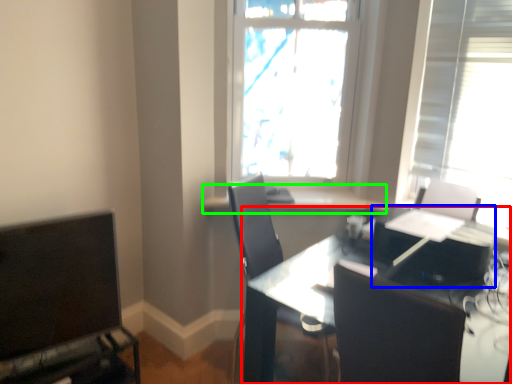
Question: Estimate the real-world distances between objects in this image. Which object is farther from table (highlighted by a red box), computer (highlighted by a blue box) or window sill (highlighted by a green box)?

Choices:
 (A) computer
 (B) window sill

Answer: (B)